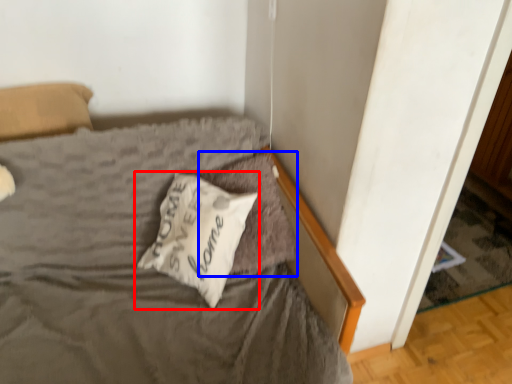
Question: Which object is further to the camera taking this photo, pillow (highlighted by a red box) or pillow (highlighted by a blue box)?

Choices:
 (A) pillow
 (B) pillow

Answer: (B)